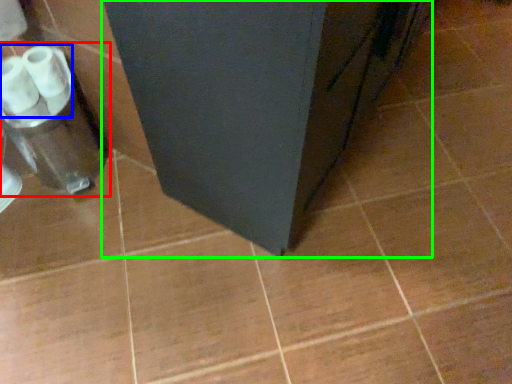
Question: Estimate the real-world distances between objects in this image. Which object is farther from blender (highlighted by a red box), toilet paper (highlighted by a blue box) or furniture (highlighted by a green box)?

Choices:
 (A) toilet paper
 (B) furniture

Answer: (B)